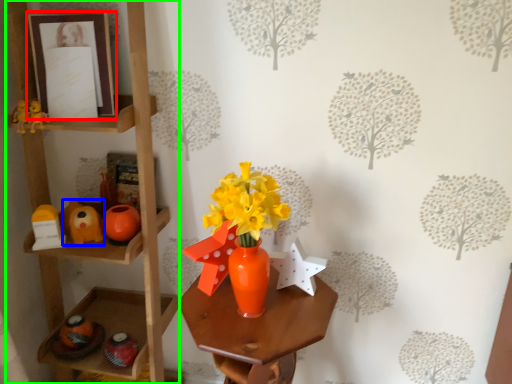
Question: Estimate the real-world distances between objects in this image. Which object is farther from picture frame (highlighted by a red box), toy (highlighted by a blue box) or shelf (highlighted by a green box)?

Choices:
 (A) toy
 (B) shelf

Answer: (A)